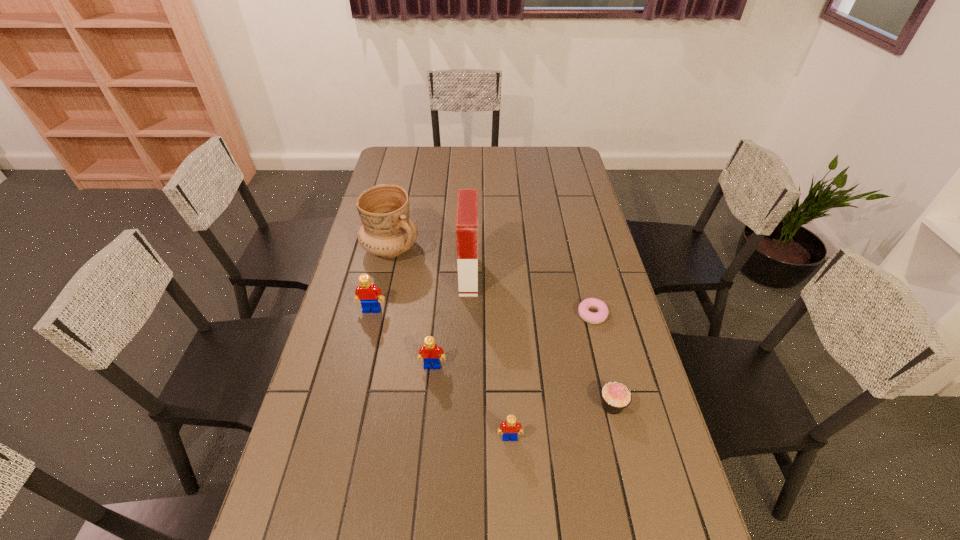
Where is `the second tallest object`? This screenshot has width=960, height=540. the second tallest object is located at coordinates (387, 231).

The height and width of the screenshot is (540, 960). What are the coordinates of `vacant region located on the front-facing side of the farthest Lego` in the screenshot? It's located at (353, 389).

This screenshot has height=540, width=960. I want to click on free region located 0.390m on the front-facing side of the third nearest object, so click(x=418, y=523).

The height and width of the screenshot is (540, 960). I want to click on free spot located 0.130m on the front-facing side of the rightmost Lego, so click(x=513, y=498).

This screenshot has width=960, height=540. In order to click on vacant position located 0.220m on the left of the shortest object in this screenshot , I will do `click(507, 314)`.

I want to click on free region located 0.330m on the front-facing side of the fourth object from right to left, so click(575, 276).

I want to click on free space located on the back of the cupcake, so click(x=603, y=367).

The image size is (960, 540). I want to click on vacant space located on the back of the second tallest object, so click(406, 180).

The height and width of the screenshot is (540, 960). Identify the location of Lego present at the left edge. (367, 293).

Locate an element on the screen. The width and height of the screenshot is (960, 540). pottery present at the left edge is located at coordinates (387, 231).